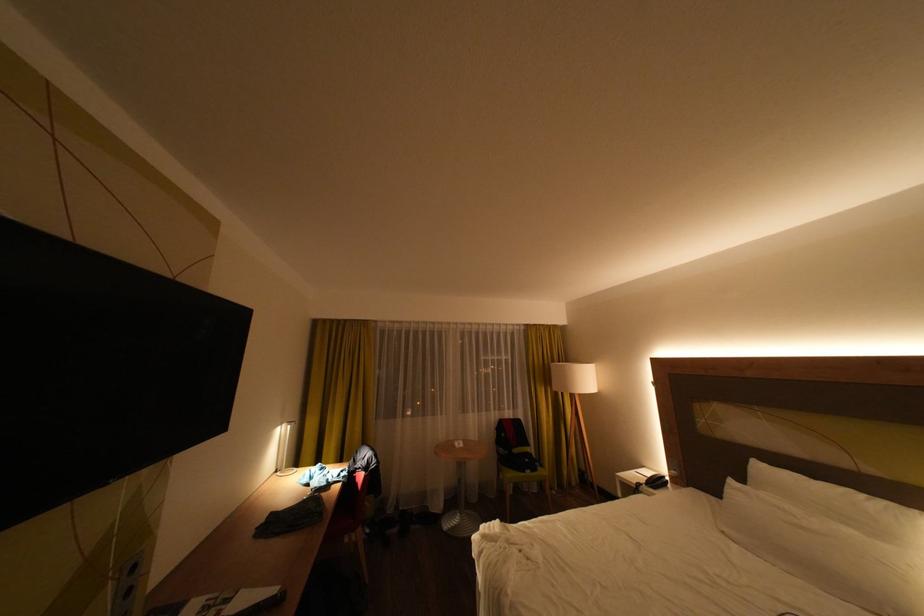
You are a GUI agent. You are given a task and a screenshot of the screen. Output one action in this format:
    pyautogui.click(x=<x>, y=<y>)
    Task: Click on the white pillow
    
    Given the screenshot: What is the action you would take?
    pyautogui.click(x=829, y=537)